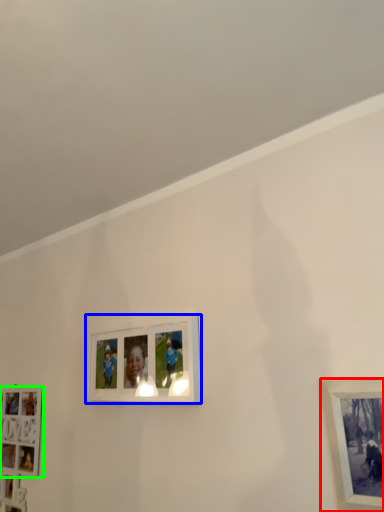
Question: Which object is positioned closest to picture frame (highlighted by a red box)? Select from picture frame (highlighted by a blue box) and picture frame (highlighted by a green box).

Choices:
 (A) picture frame
 (B) picture frame

Answer: (A)